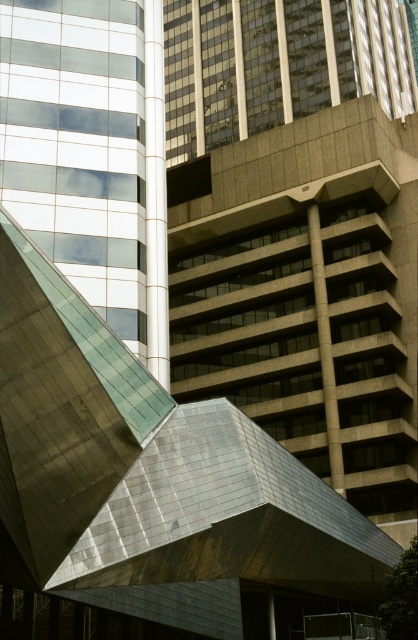
You are an architect analyzing the layout of the city. You need to determine the spatial relationship between the matte gray building at center and the metallic glass building at left. Which building is located to the right of the other?

The matte gray building at center is positioned on the right side of the metallic glass building at left, meaning the matte gray building at center is to the right of the metallic glass building at left.

You are an architect analyzing the spatial relationship between the matte gray building at center and the metallic glass building at left. Based on the scene, which building is placed higher in the image?

The matte gray building at center is positioned over the metallic glass building at left, so it is placed higher in the image.